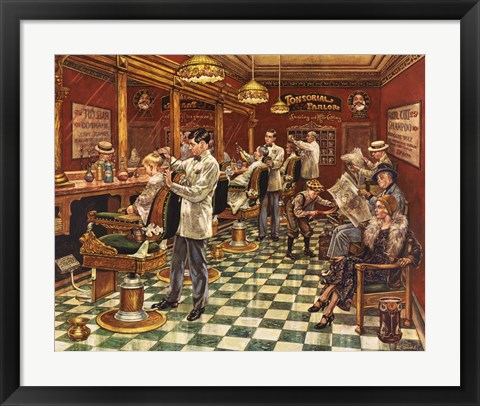
Where is `door`? door is located at coordinates (355, 137).